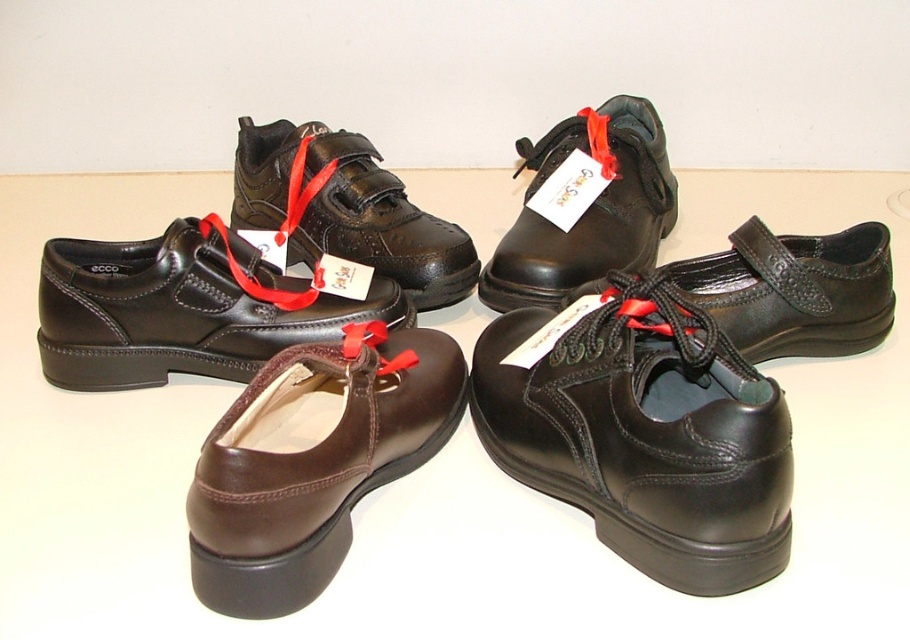
Is black leather shoe at lower right wider than black leather shoe at center?

In fact, black leather shoe at lower right might be narrower than black leather shoe at center.

This screenshot has width=910, height=640. Describe the element at coordinates (644, 438) in the screenshot. I see `black leather shoe at lower right` at that location.

The width and height of the screenshot is (910, 640). Find the location of `black leather shoe at lower right`. black leather shoe at lower right is located at coordinates (644, 438).

Is matte black shoe at lower left closer to the viewer compared to black leather shoe at center?

That is False.

Does point (177, 220) come farther from viewer compared to point (763, 264)?

No, it is in front of (763, 264).

Which is in front, point (66, 353) or point (863, 336)?

Point (66, 353) is in front.

Find the location of `matte black shoe at lower left`. matte black shoe at lower left is located at coordinates (174, 312).

Is black leather shoe at lower right taller than brown leather shoe at lower left?

Yes.

Who is more forward, (673,580) or (258,532)?

Point (258,532) is more forward.

The height and width of the screenshot is (640, 910). I want to click on black leather shoe at lower right, so click(644, 438).